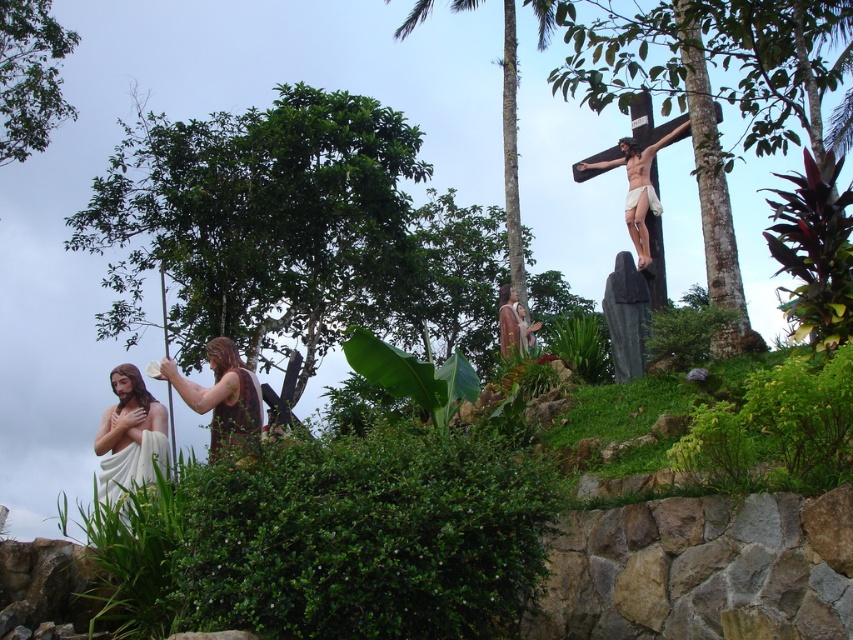
Question: Considering the real-world distances, which object is closest to the green leafy tree at left?

Choices:
 (A) green leafy tree at upper left
 (B) matte wooden cross at upper right
 (C) brown textured robe at center

Answer: (A)

Question: Is brown textured robe at center below smooth brown statue at center?

Choices:
 (A) yes
 (B) no

Answer: (A)

Question: Can you confirm if green leafy tree at left is positioned below matte wooden cross at upper right?

Choices:
 (A) no
 (B) yes

Answer: (A)

Question: Which object appears farthest from the camera in this image?

Choices:
 (A) matte wooden cross at upper right
 (B) brown textured palm tree at upper right

Answer: (A)

Question: Is green leafy tree at left positioned at the back of matte wooden cross at upper right?

Choices:
 (A) yes
 (B) no

Answer: (A)

Question: Which point is closer to the camera taking this photo?

Choices:
 (A) (143, 468)
 (B) (526, 328)

Answer: (A)